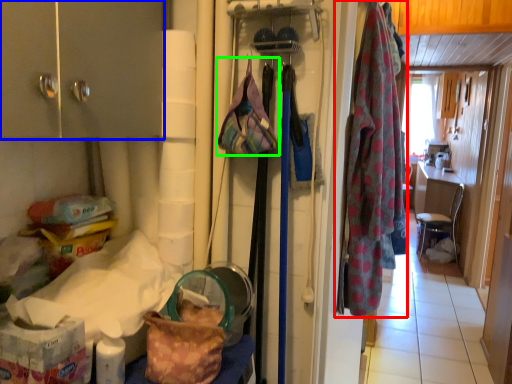
Question: Based on their relative distances, which object is farther from clothing (highlighted by a red box)? Choose from cabinetry (highlighted by a blue box) and handbag (highlighted by a green box).

Choices:
 (A) cabinetry
 (B) handbag

Answer: (A)